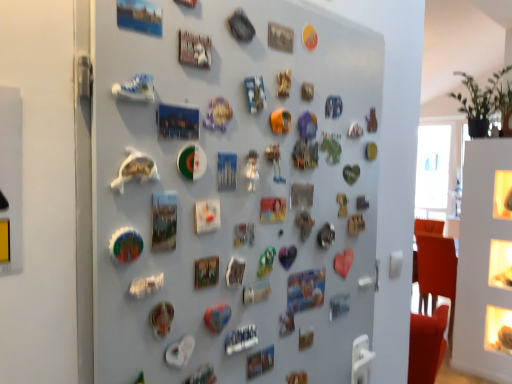
Question: From a real-world perspective, does metallic silver button at upper center, acting as the 2th button starting from the back, stand above green matte magnet at center, which is the 1th button in front-to-back order?

Choices:
 (A) no
 (B) yes

Answer: (B)

Question: Considering the relative sizes of metallic silver button at upper center, which appears as the 2th button when viewed from the right, and green matte magnet at center, which is the first button in left-to-right order, in the image provided, is metallic silver button at upper center, which appears as the 2th button when viewed from the right, shorter than green matte magnet at center, which is the first button in left-to-right order,?

Choices:
 (A) yes
 (B) no

Answer: (A)

Question: Could you tell me if metallic silver button at upper center, the 1th button viewed from the top, is facing green matte magnet at center, which is the first button in left-to-right order?

Choices:
 (A) no
 (B) yes

Answer: (A)

Question: Does metallic silver button at upper center, which appears as the 2th button when viewed from the right, lie behind green matte magnet at center, which is the first button in left-to-right order?

Choices:
 (A) no
 (B) yes

Answer: (B)

Question: Is metallic silver button at upper center, acting as the second button starting from the left, smaller than green matte magnet at center, which is the 1th button in front-to-back order?

Choices:
 (A) yes
 (B) no

Answer: (B)

Question: From the image's perspective, is metallic silver button at upper center, the 3th button ordered from the bottom, above or below matte plastic button at center, the 1th button viewed from the right?

Choices:
 (A) above
 (B) below

Answer: (A)

Question: Is point (289, 34) positioned closer to the camera than point (484, 344)?

Choices:
 (A) closer
 (B) farther

Answer: (A)

Question: Considering their positions, is metallic silver button at upper center, the 3th button ordered from the bottom, located in front of or behind matte plastic button at center, arranged as the first button when viewed from the back?

Choices:
 (A) front
 (B) behind

Answer: (A)

Question: Is metallic silver button at upper center, the 3th button ordered from the bottom, spatially inside matte plastic button at center, the 3th button when ordered from top to bottom, or outside of it?

Choices:
 (A) inside
 (B) outside

Answer: (B)

Question: From a real-world perspective, is matte plastic button at center, the 3th button when ordered from top to bottom, physically located above or below metallic fridge magnets at center?

Choices:
 (A) above
 (B) below

Answer: (B)

Question: Is matte plastic button at center, the 3th button when ordered from top to bottom, in front of or behind metallic fridge magnets at center in the image?

Choices:
 (A) behind
 (B) front

Answer: (A)

Question: In terms of size, does matte plastic button at center, the 1th button viewed from the right, appear bigger or smaller than metallic fridge magnets at center?

Choices:
 (A) small
 (B) big

Answer: (A)

Question: Is matte plastic button at center, the third button when ordered from front to back, to the left or to the right of metallic fridge magnets at center in the image?

Choices:
 (A) left
 (B) right

Answer: (B)

Question: Relative to metallic fridge magnets at center, is green matte magnet at center, the 2th button positioned from the bottom, in front or behind?

Choices:
 (A) behind
 (B) front

Answer: (A)

Question: Considering the positions of point (195, 274) and point (276, 264), is point (195, 274) closer or farther from the camera than point (276, 264)?

Choices:
 (A) farther
 (B) closer

Answer: (B)